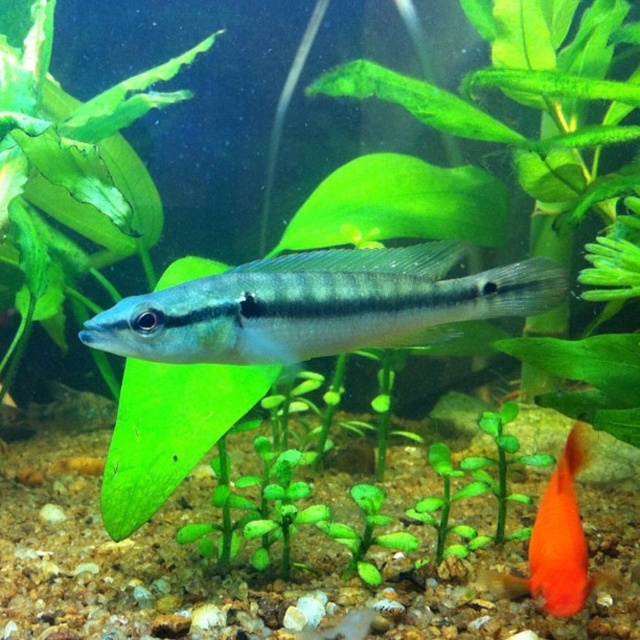
You are a diver in the aquarium and you see two points marked in the image. The first point is at coordinates point (436, 314) and the second is at point (554, 611). Which point is closer to you?

Point (436, 314) is in front of point (554, 611), so the first point is closer to you.

You are an underwater photographer aiming to capture both the satin silver fish at center and the orange glossy fish at lower right in a single frame. Given their sizes, which fish should you focus on first to ensure they both fit in the photo?

Since the satin silver fish at center is smaller than the orange glossy fish at lower right, you should focus on positioning the larger orange glossy fish at lower right first to ensure it fits properly in the frame, then adjust to include the smaller satin silver fish at center.